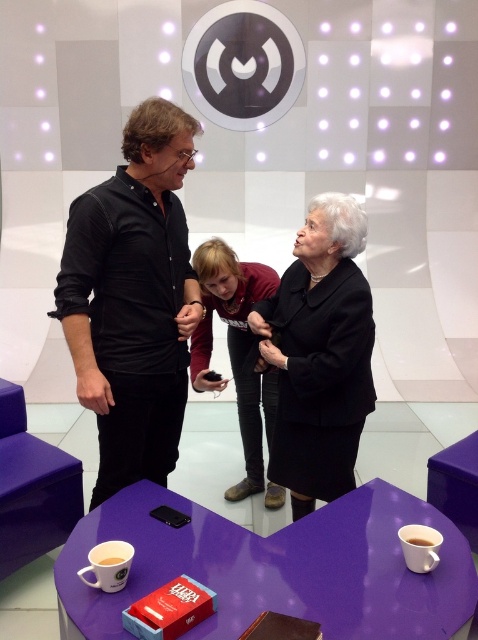
You are organizing a small gathering and need to place a decorative item on the table. The table has a matte brown leather jacket at center and a white ceramic mug at lower right. Which object is closer to you if you are standing at the front of the table?

The matte brown leather jacket at center is closer to you because the white ceramic mug at lower right is behind it.

You are a photographer setting up a shoot in this studio. You need to adjust the lighting so that both the black matte shirt at center and the matte brown leather jacket at center are equally visible. Considering their positions, which one might require more direct lighting to ensure it doesn not appear too dark?

The black matte shirt at center is in front of the matte brown leather jacket at center. Since black absorbs more light, the black matte shirt at center might require more direct lighting to ensure it does not appear too dark compared to the matte brown leather jacket at center.